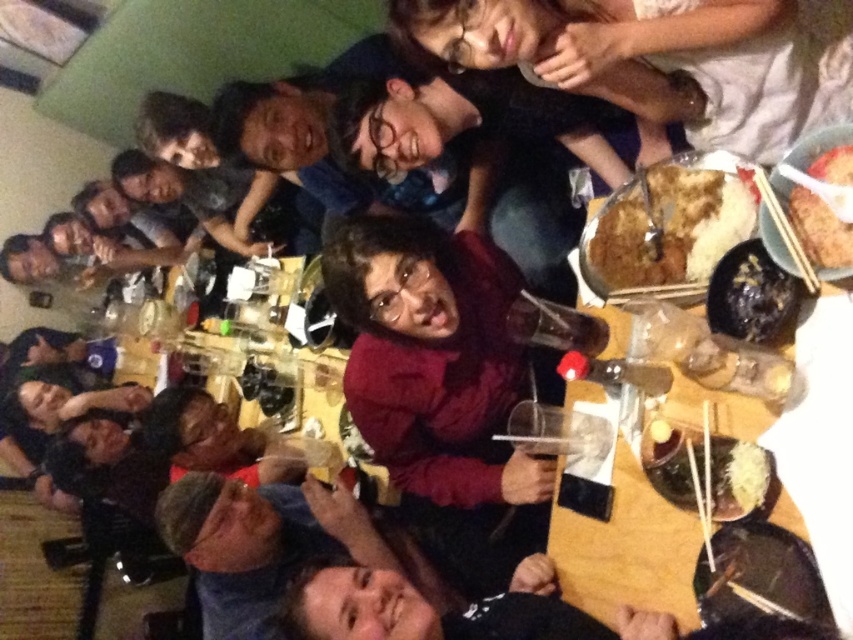
From the picture: You are sitting at the table and want to reach for an item located at point A and another at point B. If point A corresponds to point (672, 164) and point B to (844, 224), which point is closer to you as you sit at the table?

Point B at (844, 224) is closer to you because point A at (672, 164) is behind it.

You are a food critic who needs to describe the rice dishes in the image. Which rice dish is bigger in size between the brown crispy rice at center and the brown rice at upper right?

The brown crispy rice at center has a larger size compared to the brown rice at upper right, so the brown crispy rice at center is bigger.

You are a photographer standing at the edge of the table. You want to take a photo of the dark red sweater at center so that it appears sharp and in focus. Considering your current position, will the sweater be within the camera focus range if the camera can focus as close as 1 meter?

The dark red sweater at center is 1.17 meters away from the camera. Since the camera can focus as close as 1 meter, the sweater is within the focus range and will appear sharp and in focus.